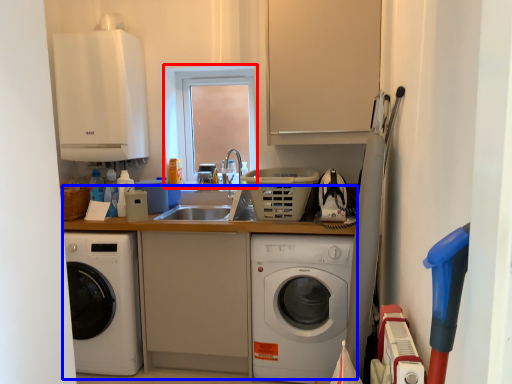
Question: Among these objects, which one is farthest to the camera, window (highlighted by a red box) or counter top (highlighted by a blue box)?

Choices:
 (A) window
 (B) counter top

Answer: (A)